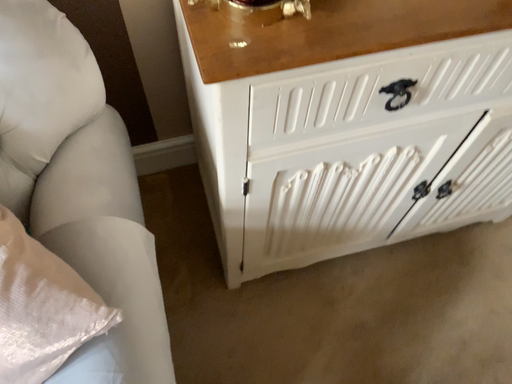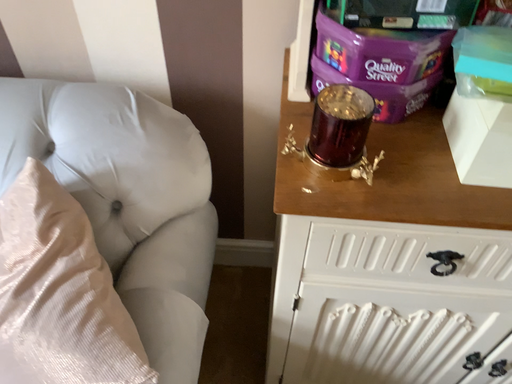
Question: How did the camera likely rotate when shooting the video?

Choices:
 (A) rotated downward
 (B) rotated upward

Answer: (B)